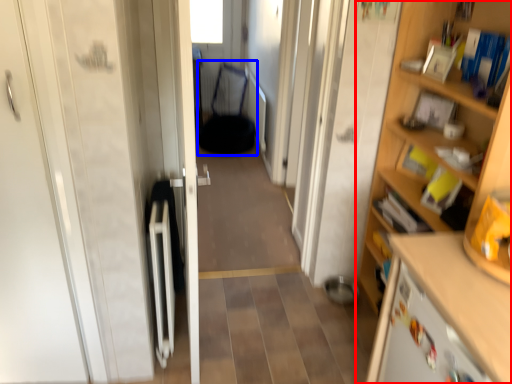
Question: Which of the following is the farthest to the observer, cupboard (highlighted by a red box) or armchair (highlighted by a blue box)?

Choices:
 (A) cupboard
 (B) armchair

Answer: (B)